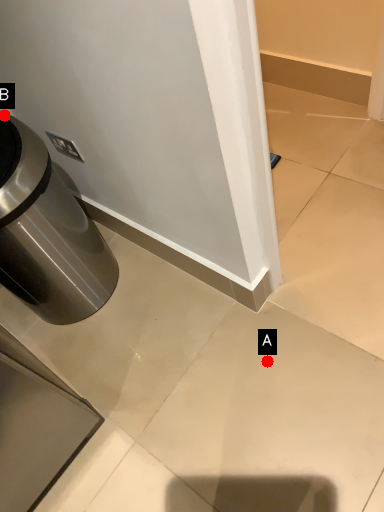
Question: Two points are circled on the image, labeled by A and B beside each circle. Which of the following is the farthest from the observer?

Choices:
 (A) A is further
 (B) B is further

Answer: (B)